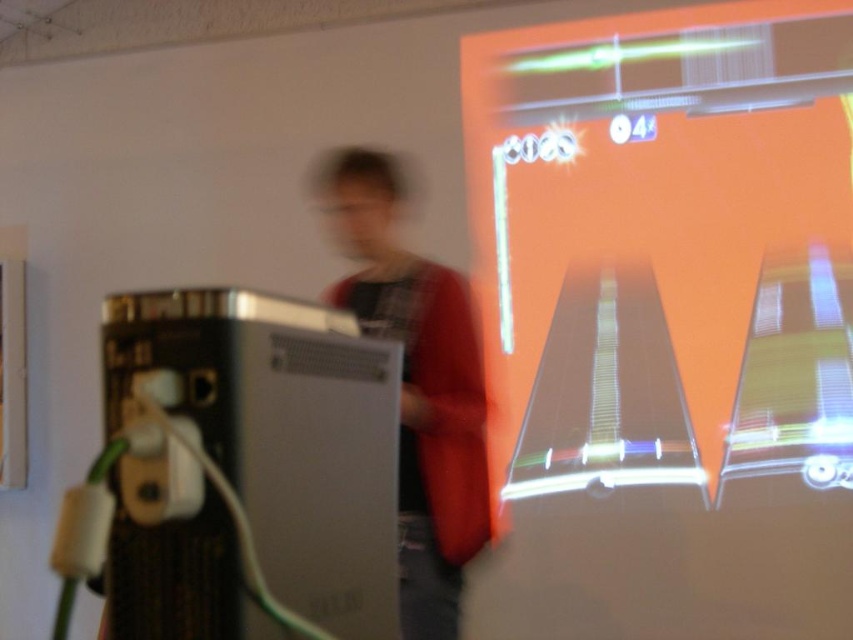
Question: Is metallic silver console at left bigger than white plastic plug at lower left?

Choices:
 (A) yes
 (B) no

Answer: (A)

Question: Does metallic silver console at left have a smaller size compared to red sweater at center?

Choices:
 (A) no
 (B) yes

Answer: (B)

Question: Does orange glossy projection screen at upper right appear over metallic silver console at left?

Choices:
 (A) no
 (B) yes

Answer: (B)

Question: Which point is farther from the camera taking this photo?

Choices:
 (A) (115, 582)
 (B) (438, 365)

Answer: (B)

Question: Among these objects, which one is farthest from the camera?

Choices:
 (A) orange glossy projection screen at upper right
 (B) metallic silver console at left

Answer: (A)

Question: Which point is closer to the camera?

Choices:
 (A) metallic silver console at left
 (B) red sweater at center
 (C) orange glossy projection screen at upper right
 (D) white plastic plug at lower left

Answer: (A)